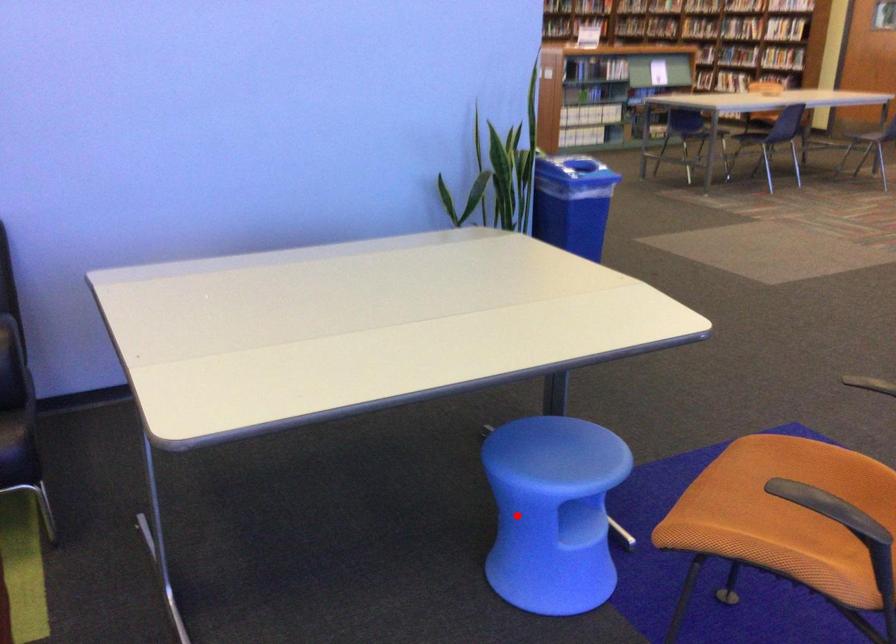
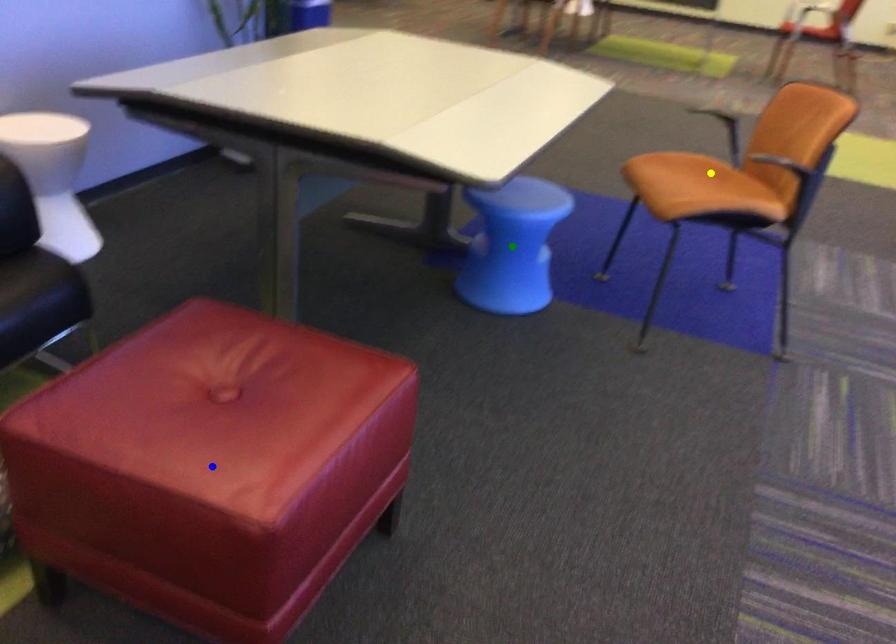
Question: I am providing you with two images of the same scene from different viewpoints. A red point is marked on the first image. You are given multiple points on the second image. Which point in image 2 represents the same 3d spot as the red point in image 1?

Choices:
 (A) green point
 (B) yellow point
 (C) blue point

Answer: (A)